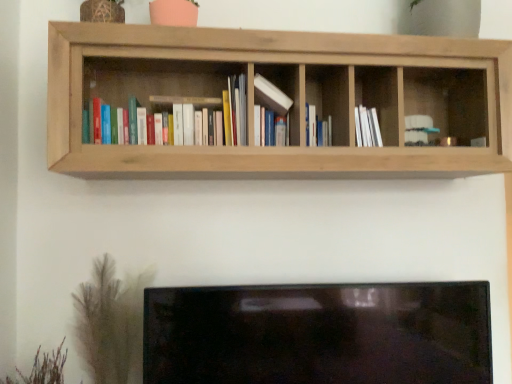
Question: Looking at their shapes, would you say white paper book at center, acting as the 3th book starting from the left, is wider or thinner than green grass at lower left, which ranks as the first plant in left-to-right order?

Choices:
 (A) thin
 (B) wide

Answer: (A)

Question: Is point (308, 104) positioned closer to the camera than point (46, 354)?

Choices:
 (A) closer
 (B) farther

Answer: (B)

Question: Based on their relative distances, which object is farther from the white paper at center?

Choices:
 (A) natural wood shelf at upper center
 (B) white paper book at center, placed as the 1th book when sorted from right to left
 (C) brown textured plant at lower left, the first plant from the right
 (D) white matte book at center, which is the 2th book in left-to-right order
 (E) matte hardcover books at left, placed as the 3th book when sorted from right to left

Answer: (C)

Question: Which of these objects is positioned farthest from the white paper book at center, acting as the 3th book starting from the left?

Choices:
 (A) white matte book at center, acting as the 2th book starting from the right
 (B) brown textured plant at lower left, the first plant from the right
 (C) matte hardcover books at left, placed as the 3th book when sorted from right to left
 (D) white paper at center
 (E) natural wood shelf at upper center

Answer: (B)